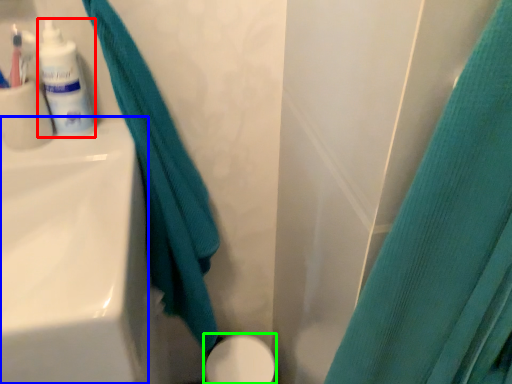
Question: Based on their relative distances, which object is nearer to toiletry (highlighted by a red box)? Choose from sink (highlighted by a blue box) and porcelain (highlighted by a green box).

Choices:
 (A) sink
 (B) porcelain

Answer: (A)